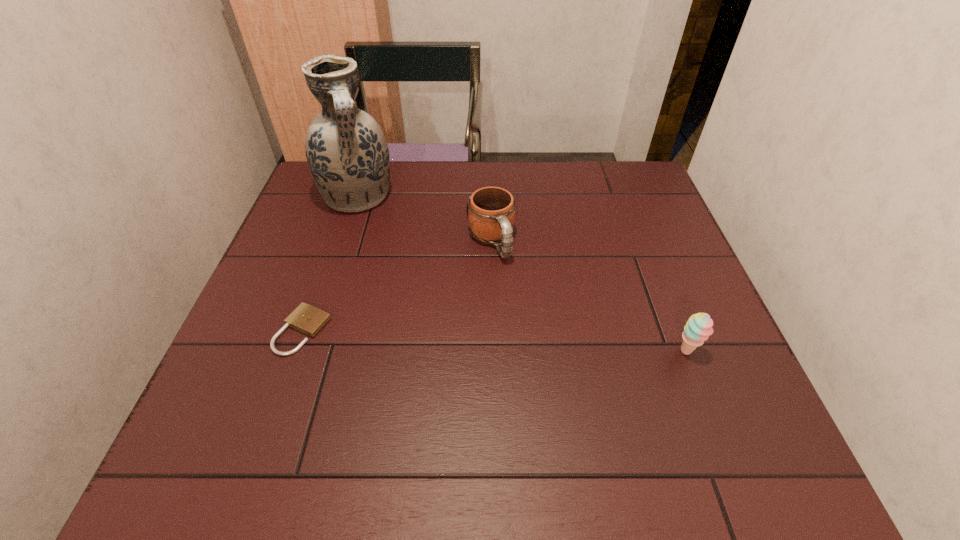
The width and height of the screenshot is (960, 540). Identify the location of vacant space on the desktop that is between the shortest object and the rightmost object and is positioned with the handle on the side of the vase. (439, 338).

You are a GUI agent. You are given a task and a screenshot of the screen. Output one action in this format:
    pyautogui.click(x=<x>, y=<y>)
    Task: Click on the vacant space on the desktop that is between the padlock and the sherbert and is positioned on the side of the third object from left to right with the handle
    This screenshot has height=540, width=960.
    Given the screenshot: What is the action you would take?
    pyautogui.click(x=542, y=343)